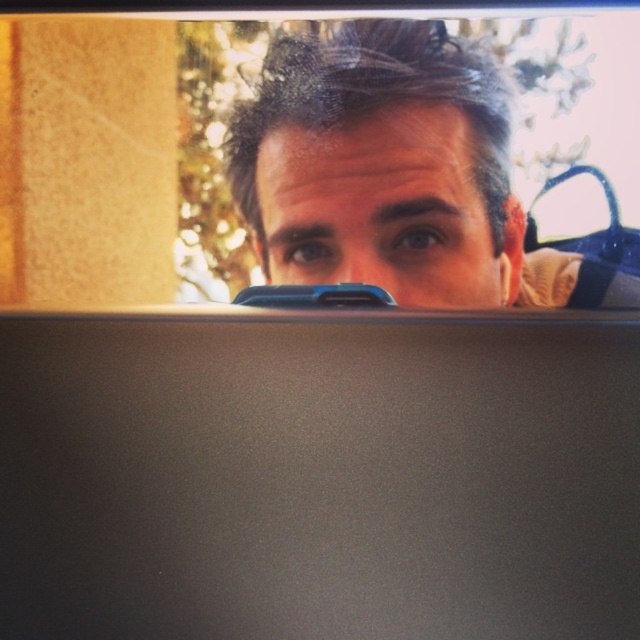
Question: Observing the image, what is the correct spatial positioning of matte black view mirror at upper center in reference to matte black hair at upper center?

Choices:
 (A) above
 (B) below

Answer: (A)

Question: Among these points, which one is nearest to the camera?

Choices:
 (A) (481, 68)
 (B) (404, 19)

Answer: (A)

Question: Which of the following is the closest to the observer?

Choices:
 (A) matte black view mirror at upper center
 (B) matte black hair at upper center

Answer: (A)

Question: Can you confirm if matte black view mirror at upper center is bigger than matte black hair at upper center?

Choices:
 (A) yes
 (B) no

Answer: (A)

Question: Does matte black view mirror at upper center appear on the left side of matte black hair at upper center?

Choices:
 (A) yes
 (B) no

Answer: (B)

Question: Which object is farther from the camera taking this photo?

Choices:
 (A) matte black hair at upper center
 (B) matte black view mirror at upper center

Answer: (A)